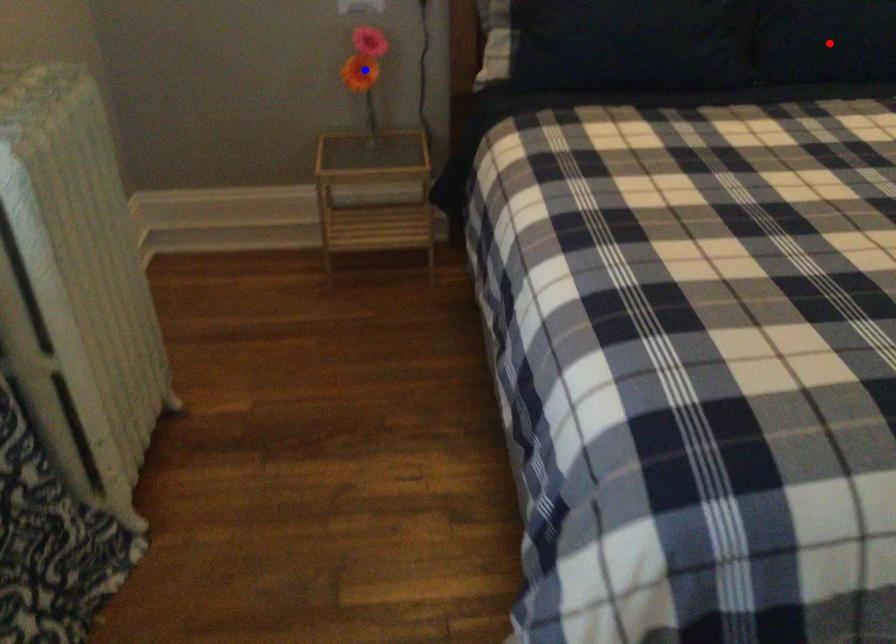
Question: Which of the two points in the image is closer to the camera?

Choices:
 (A) Blue point is closer.
 (B) Red point is closer.

Answer: (B)